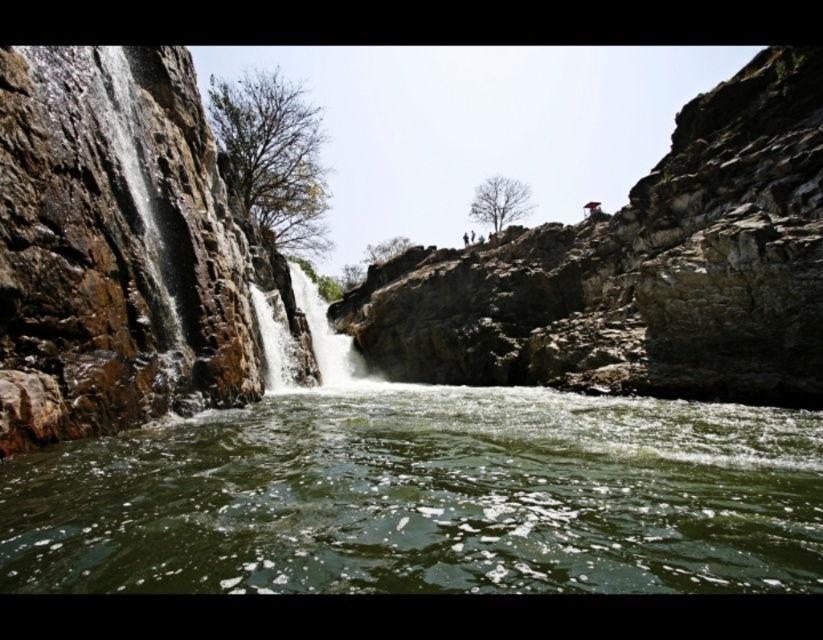
You are standing at the edge of the scene and want to cross the water. You have two options to choose from the image. Which one would you choose between the green smooth river at center and the smooth white water at center, and why?

The green smooth river at center is closer to the viewer than the smooth white water at center, so it would be easier to cross the green smooth river at center because it is nearer and more stable.

You are standing at the edge of a cliff overlooking the scene. You want to throw a pebble into the green smooth river at center. Considering the distance, will the pebble reach the river if you throw it with a typical human throwing distance of 30 meters?

The green smooth river at center is 35.78 meters away, which is farther than the typical human throwing distance of 30 meters. The pebble may not reach the river.

You are standing at the edge of the green smooth river at center. Which direction should you walk to reach the point marked at coordinates point (425, 497)?

The green smooth river at center is already located at point (425, 497), so you are already at the desired location.